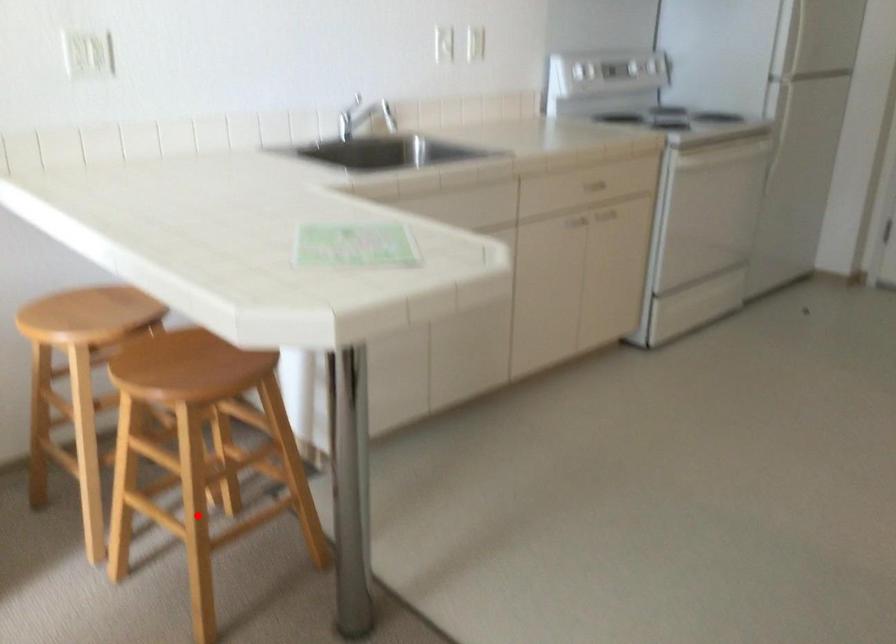
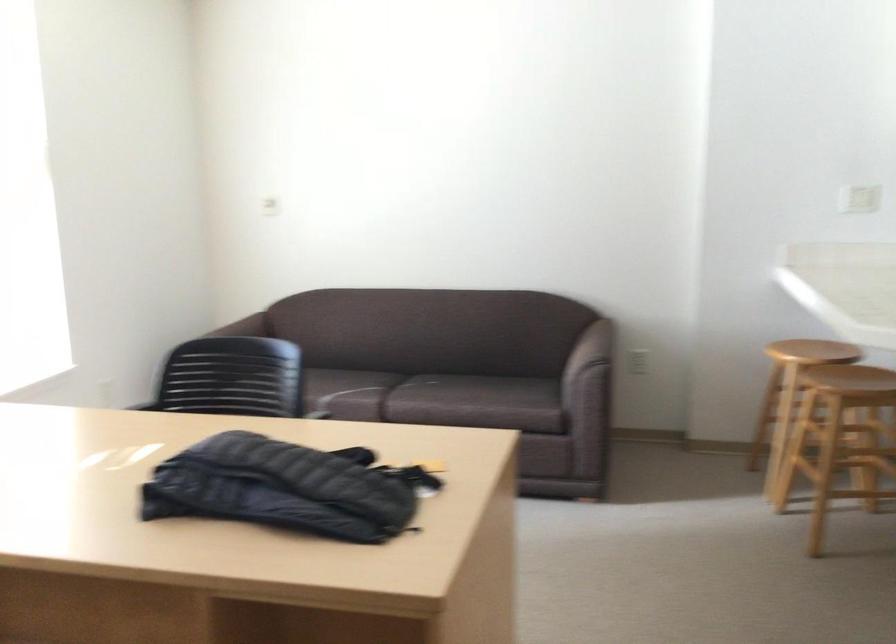
Question: I am providing you with two images of the same scene from different viewpoints. A red point is marked on the first image. At the location where the point appears in image 1, is it still visible in image 2?

Choices:
 (A) Yes
 (B) No

Answer: (A)